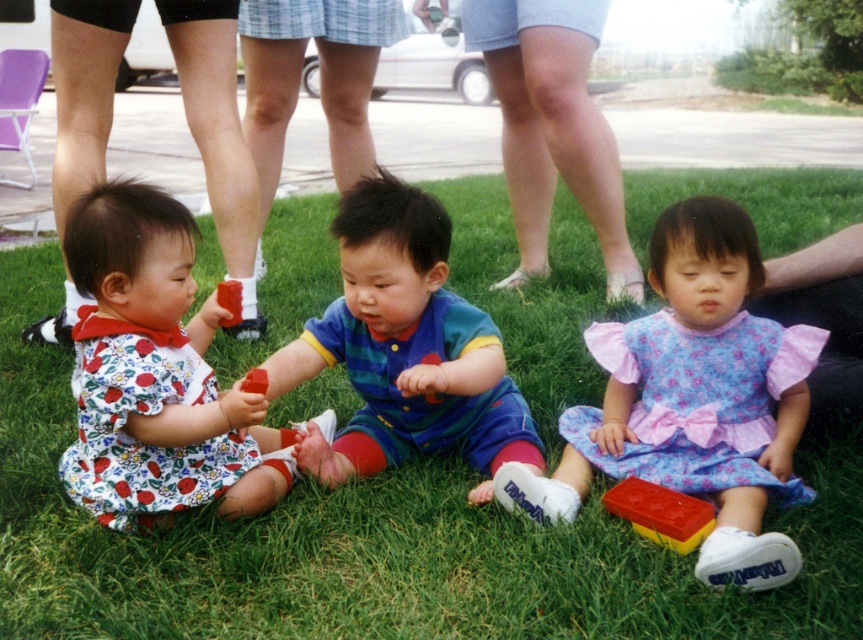
You are a photographer trying to capture a closeup shot of the yellow rubber block at lower center without including the floral fabric dress at left in the frame. Based on their sizes, do you think this is possible?

The floral fabric dress at left is wider than the yellow rubber block at lower center, so it might be challenging to frame the yellow rubber block at lower center without including the floral fabric dress at left due to its larger width.

You are a photographer trying to capture a photo of the children in the scene. You want to ensure that both the floral cotton dress at lower right and the striped cotton onesie at center are clearly visible in the frame. Based on their heights, which child should you focus on first to ensure proper focus?

The floral cotton dress at lower right is taller than the striped cotton onesie at center, so you should focus on the floral cotton dress at lower right first to ensure proper focus.